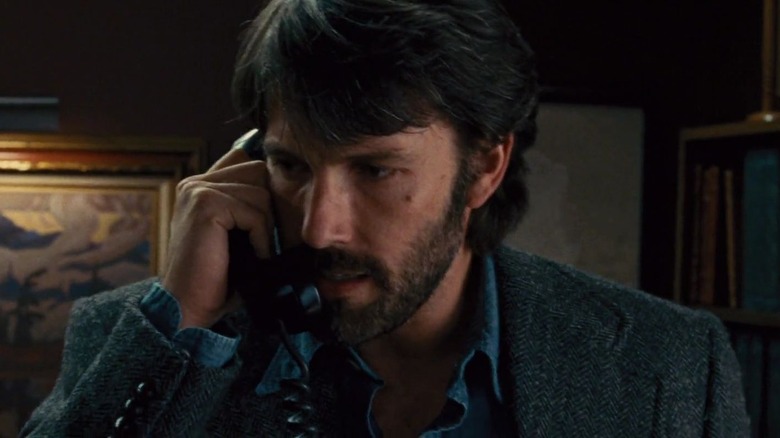
Where is `painting`? Image resolution: width=780 pixels, height=438 pixels. painting is located at coordinates (84, 256).